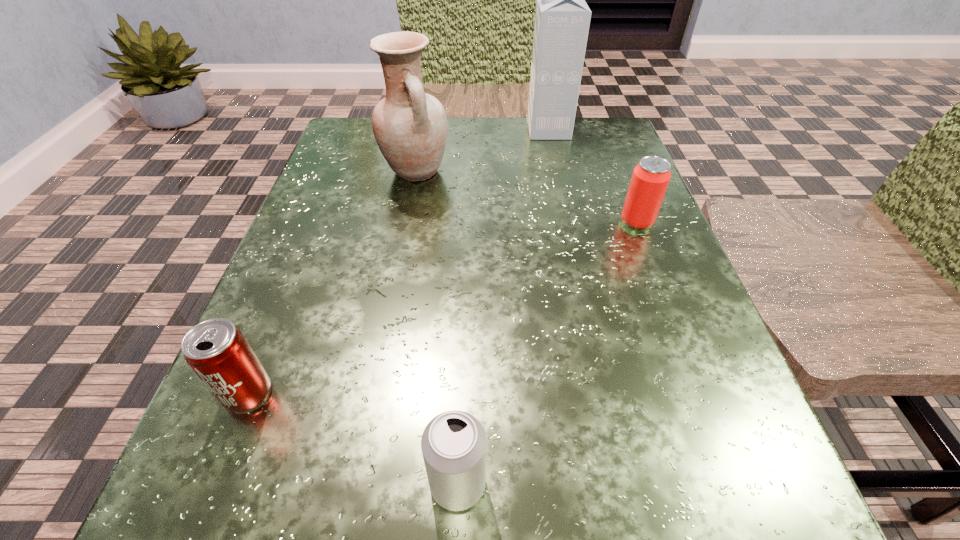
Where is `free point located 0.380m on the front label of the second object from right to left`? The height and width of the screenshot is (540, 960). free point located 0.380m on the front label of the second object from right to left is located at coordinates (361, 130).

This screenshot has height=540, width=960. Find the location of `vacant area located on the front label of the second object from right to left`. vacant area located on the front label of the second object from right to left is located at coordinates (485, 130).

I want to click on free region located 0.220m on the front label of the second object from right to left, so click(x=431, y=130).

Where is `vacant space located on the back of the fourth shortest object`? This screenshot has height=540, width=960. vacant space located on the back of the fourth shortest object is located at coordinates (422, 135).

Where is `free region located on the front of the third farthest object`? This screenshot has height=540, width=960. free region located on the front of the third farthest object is located at coordinates (691, 363).

This screenshot has height=540, width=960. Identify the location of free point located on the left of the nearest beer can. (326, 483).

Identify the location of vacant space located 0.200m on the back of the second nearest object. This screenshot has height=540, width=960. (300, 264).

Find the location of a particular element. carton located in the far edge section of the desktop is located at coordinates (562, 19).

The width and height of the screenshot is (960, 540). Find the location of `pottery located in the far edge section of the desktop`. pottery located in the far edge section of the desktop is located at coordinates (410, 126).

Identify the location of object positioned at the near edge. (453, 444).